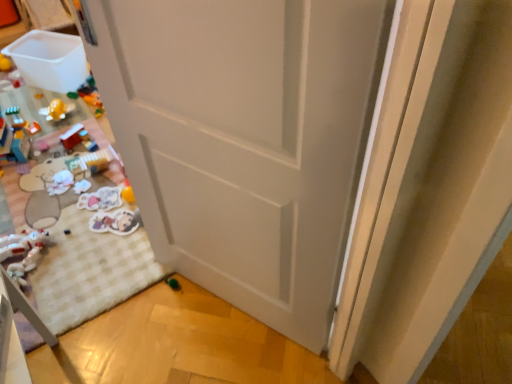
The image size is (512, 384). Identify the location of matte plastic stickers at lower left, marked as the third toy in a right-to-left arrangement. (101, 199).

Find the location of a particular element. This screenshot has height=384, width=512. green rubber toy at lower center, the eighth toy in the left-to-right sequence is located at coordinates (173, 283).

Measure the distance between translucent plastic toy at left, which is the 1th toy in left-to-right order, and camera.

translucent plastic toy at left, which is the 1th toy in left-to-right order, and camera are 2.09 meters apart from each other.

Where is `white matte door at center`? white matte door at center is located at coordinates 244,139.

Measure the distance between matte plastic stickers at lower left, positioned as the 2th toy in right-to-left order, and camera.

matte plastic stickers at lower left, positioned as the 2th toy in right-to-left order, is 5.87 feet from camera.

At what (x,y) coordinates should I click in order to perform the action: click on matte plastic stickers at lower left, marked as the third toy in a right-to-left arrangement. Please return your answer as a coordinate pair (x, y). The width and height of the screenshot is (512, 384). Looking at the image, I should click on (101, 199).

From the image's perspective, between matte plastic toy at lower left, positioned as the 3th toy in left-to-right order, and white matte door at center, who is located below?

From the image's view, white matte door at center is below.

Could you tell me if matte plastic toy at lower left, positioned as the 3th toy in left-to-right order, is facing white matte door at center?

No.

Consider the image. Which point is more distant from viewer, (76, 124) or (202, 1)?

Point (76, 124)

Between matte plastic toy at lower left, positioned as the 3th toy in left-to-right order, and white matte door at center, which one appears on the left side from the viewer's perspective?

matte plastic toy at lower left, positioned as the 3th toy in left-to-right order, is more to the left.

Is translucent plastic toy at left, which is the 8th toy from right to left, surrounded by white matte door at center?

No, translucent plastic toy at left, which is the 8th toy from right to left, is not inside white matte door at center.

Can you confirm if white matte door at center is shorter than translucent plastic toy at left, which is the 8th toy from right to left?

No, white matte door at center is not shorter than translucent plastic toy at left, which is the 8th toy from right to left.

From the image's perspective, which is above, white matte door at center or translucent plastic toy at left, which is the 1th toy in left-to-right order?

translucent plastic toy at left, which is the 1th toy in left-to-right order, from the image's perspective.

Considering the points (259, 178) and (23, 131), which point is behind, point (259, 178) or point (23, 131)?

Point (23, 131)

Does white plush toy at lower left, positioned as the 4th toy in left-to-right order, have a greater width compared to matte black toy at lower left, the 4th toy from the right?

Indeed, white plush toy at lower left, positioned as the 4th toy in left-to-right order, has a greater width compared to matte black toy at lower left, the 4th toy from the right.

Is white plush toy at lower left, positioned as the 4th toy in left-to-right order, situated inside matte black toy at lower left, the 4th toy from the right, or outside?

white plush toy at lower left, positioned as the 4th toy in left-to-right order, is spatially situated outside matte black toy at lower left, the 4th toy from the right.

Where is `the 4th toy behind the matte black toy at lower left, the 5th toy in the left-to-right sequence`? the 4th toy behind the matte black toy at lower left, the 5th toy in the left-to-right sequence is located at coordinates (61, 183).

Is white plush toy at lower left, which ranks as the fifth toy in right-to-left order, at the left side of matte black toy at lower left, the 5th toy in the left-to-right sequence?

Yes, white plush toy at lower left, which ranks as the fifth toy in right-to-left order, is to the left of matte black toy at lower left, the 5th toy in the left-to-right sequence.

Is white plush toy at lower left, which ranks as the fifth toy in right-to-left order, oriented away from white matte door at center?

No.

Is white plush toy at lower left, positioned as the 4th toy in left-to-right order, not near white matte door at center?

Absolutely, white plush toy at lower left, positioned as the 4th toy in left-to-right order, is distant from white matte door at center.

From a real-world perspective, is white plush toy at lower left, which ranks as the fifth toy in right-to-left order, below white matte door at center?

Yes, from a real-world perspective, white plush toy at lower left, which ranks as the fifth toy in right-to-left order, is under white matte door at center.

Is the position of white plush toy at lower left, which ranks as the fifth toy in right-to-left order, more distant than that of white matte door at center?

Yes, it is.

Is matte plastic toy at lower left, positioned as the 3th toy in left-to-right order, further to camera compared to white plush toy at lower left, which ranks as the fifth toy in right-to-left order?

Yes, the depth of matte plastic toy at lower left, positioned as the 3th toy in left-to-right order, is greater than that of white plush toy at lower left, which ranks as the fifth toy in right-to-left order.

Is matte plastic toy at lower left, the 6th toy when ordered from right to left, spatially inside white plush toy at lower left, which ranks as the fifth toy in right-to-left order, or outside of it?

matte plastic toy at lower left, the 6th toy when ordered from right to left, is located beyond the bounds of white plush toy at lower left, which ranks as the fifth toy in right-to-left order.

Consider the image. Which object is positioned more to the right, matte plastic toy at lower left, the 6th toy when ordered from right to left, or white plush toy at lower left, which ranks as the fifth toy in right-to-left order?

Positioned to the right is white plush toy at lower left, which ranks as the fifth toy in right-to-left order.

Does matte plastic toy at lower left, the 6th toy when ordered from right to left, have a larger size compared to white plush toy at lower left, which ranks as the fifth toy in right-to-left order?

Indeed, matte plastic toy at lower left, the 6th toy when ordered from right to left, has a larger size compared to white plush toy at lower left, which ranks as the fifth toy in right-to-left order.

Which toy is the 4th one when counting from the front of the matte plastic toy at lower left, the 6th toy when ordered from right to left? Please provide its 2D coordinates.

[(116, 222)]

Between matte plastic toy at lower left, the 6th toy when ordered from right to left, and matte plastic stickers at lower left, which ranks as the seventh toy in left-to-right order, which one has larger size?

Bigger between the two is matte plastic stickers at lower left, which ranks as the seventh toy in left-to-right order.

From a real-world perspective, is matte plastic toy at lower left, the 6th toy when ordered from right to left, physically located above or below matte plastic stickers at lower left, positioned as the 2th toy in right-to-left order?

From a real-world perspective, matte plastic toy at lower left, the 6th toy when ordered from right to left, is physically above matte plastic stickers at lower left, positioned as the 2th toy in right-to-left order.

Locate an element on the screen. Image resolution: width=512 pixels, height=384 pixels. the 2nd toy behind the matte plastic stickers at lower left, positioned as the 2th toy in right-to-left order, counting from the anchor's position is located at coordinates (101, 199).

In the image, is matte plastic stickers at lower left, which ranks as the sixth toy in left-to-right order, positioned in front of or behind matte plastic stickers at lower left, positioned as the 2th toy in right-to-left order?

Visually, matte plastic stickers at lower left, which ranks as the sixth toy in left-to-right order, is located behind matte plastic stickers at lower left, positioned as the 2th toy in right-to-left order.

Which is more to the left, matte plastic stickers at lower left, which ranks as the sixth toy in left-to-right order, or matte plastic stickers at lower left, which ranks as the seventh toy in left-to-right order?

matte plastic stickers at lower left, which ranks as the sixth toy in left-to-right order.

From a real-world perspective, which is physically below, matte plastic stickers at lower left, marked as the third toy in a right-to-left arrangement, or matte plastic stickers at lower left, positioned as the 2th toy in right-to-left order?

From a 3D spatial view, matte plastic stickers at lower left, marked as the third toy in a right-to-left arrangement, is below.

Where is `toy that is the 2nd object located above the white matte door at center (from the image's perspective)`? The height and width of the screenshot is (384, 512). toy that is the 2nd object located above the white matte door at center (from the image's perspective) is located at coordinates (72, 136).

Locate an element on the screen. door above the translucent plastic toy at left, which is the 8th toy from right to left (from a real-world perspective) is located at coordinates (244, 139).

Which object lies further to the anchor point white plush toy at lower left, marked as the 7th toy in a right-to-left arrangement, matte plastic toy at lower left, positioned as the 3th toy in left-to-right order, or green rubber toy at lower center, the eighth toy in the left-to-right sequence?

Based on the image, matte plastic toy at lower left, positioned as the 3th toy in left-to-right order, appears to be further to white plush toy at lower left, marked as the 7th toy in a right-to-left arrangement.

Based on their spatial positions, is green rubber toy at lower center, the eighth toy in the left-to-right sequence, or matte plastic stickers at lower left, marked as the third toy in a right-to-left arrangement, closer to white plush toy at lower left, positioned as the 4th toy in left-to-right order?

matte plastic stickers at lower left, marked as the third toy in a right-to-left arrangement, lies closer to white plush toy at lower left, positioned as the 4th toy in left-to-right order, than the other object.

Which object lies nearer to the anchor point white plush toy at lower left, positioned as the 4th toy in left-to-right order, white matte door at center or green rubber toy at lower center, the first toy from the right?

green rubber toy at lower center, the first toy from the right, is positioned closer to the anchor white plush toy at lower left, positioned as the 4th toy in left-to-right order.

From the picture: When comparing their distances from white plush toy at lower left, marked as the 7th toy in a right-to-left arrangement, does green rubber toy at lower center, the eighth toy in the left-to-right sequence, or translucent plastic toy at left, which is the 1th toy in left-to-right order, seem closer?

Based on the image, translucent plastic toy at left, which is the 1th toy in left-to-right order, appears to be nearer to white plush toy at lower left, marked as the 7th toy in a right-to-left arrangement.

Based on their spatial positions, is matte plastic toy at lower left, positioned as the 3th toy in left-to-right order, or translucent plastic toy at left, which is the 1th toy in left-to-right order, closer to white matte door at center?

matte plastic toy at lower left, positioned as the 3th toy in left-to-right order, is closer to white matte door at center.

Looking at the image, which one is located closer to white plush toy at lower left, which ranks as the fifth toy in right-to-left order, translucent plastic toy at left, which is the 8th toy from right to left, or matte black toy at lower left, the 4th toy from the right?

The object closer to white plush toy at lower left, which ranks as the fifth toy in right-to-left order, is matte black toy at lower left, the 4th toy from the right.

Looking at this image, which object lies nearer to the anchor point translucent plastic toy at left, which is the 1th toy in left-to-right order, matte plastic stickers at lower left, which ranks as the seventh toy in left-to-right order, or white plush toy at lower left, positioned as the 4th toy in left-to-right order?

white plush toy at lower left, positioned as the 4th toy in left-to-right order, is positioned closer to the anchor translucent plastic toy at left, which is the 1th toy in left-to-right order.

Which object lies nearer to the anchor point white plush toy at lower left, marked as the 7th toy in a right-to-left arrangement, matte plastic stickers at lower left, which ranks as the sixth toy in left-to-right order, or matte plastic stickers at lower left, positioned as the 2th toy in right-to-left order?

matte plastic stickers at lower left, positioned as the 2th toy in right-to-left order.

Identify the location of toy between matte black toy at lower left, the 5th toy in the left-to-right sequence, and matte plastic stickers at lower left, positioned as the 2th toy in right-to-left order, from left to right. (101, 199).

Identify the location of toy between white matte door at center and green rubber toy at lower center, the first toy from the right, in the front-back direction. Image resolution: width=512 pixels, height=384 pixels. (22, 252).

You are a GUI agent. You are given a task and a screenshot of the screen. Output one action in this format:
    pyautogui.click(x=<x>, y=<y>)
    Task: Click on the toy between matte plastic toy at lower left, the 6th toy when ordered from right to left, and matte plastic stickers at lower left, marked as the third toy in a right-to-left arrangement, vertically
    
    Given the screenshot: What is the action you would take?
    pyautogui.click(x=61, y=183)

Where is `toy situated between matte plastic stickers at lower left, which ranks as the sixth toy in left-to-right order, and green rubber toy at lower center, the eighth toy in the left-to-right sequence, from left to right`? The height and width of the screenshot is (384, 512). toy situated between matte plastic stickers at lower left, which ranks as the sixth toy in left-to-right order, and green rubber toy at lower center, the eighth toy in the left-to-right sequence, from left to right is located at coordinates (116, 222).